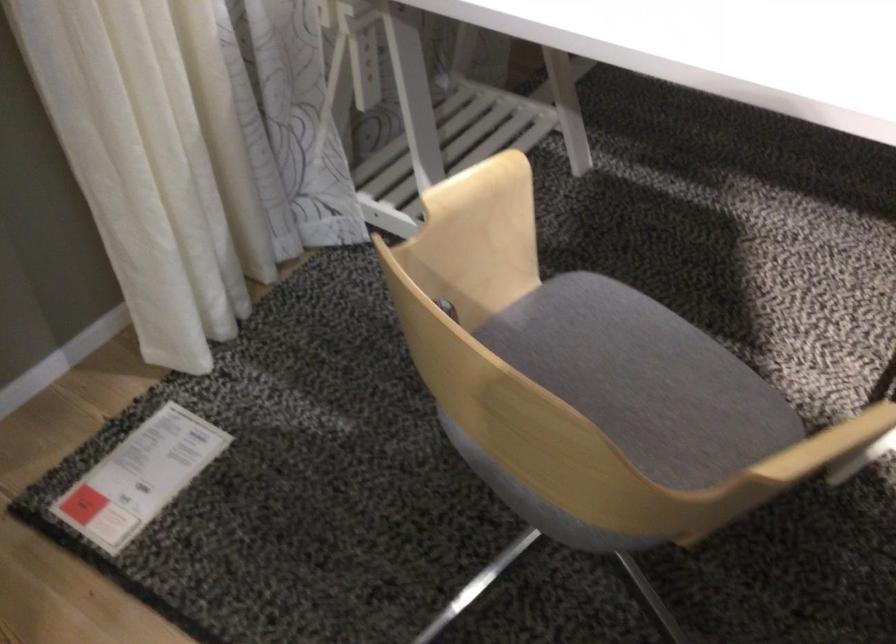
I want to click on wooden chair armrest, so click(467, 163).